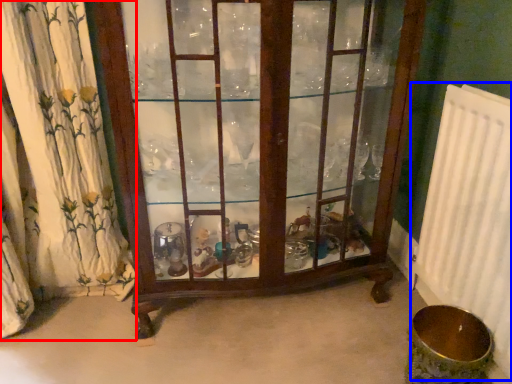
Question: Which object appears farthest to the camera in this image, curtain (highlighted by a red box) or radiator (highlighted by a blue box)?

Choices:
 (A) curtain
 (B) radiator

Answer: (A)